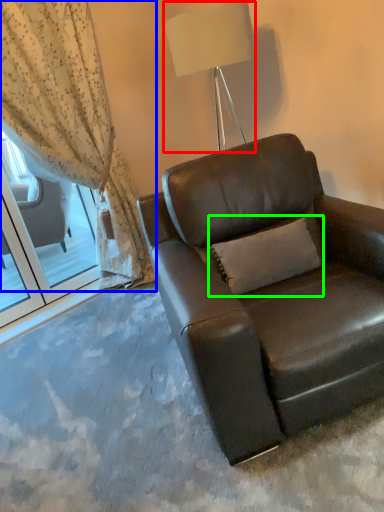
Question: Considering the real-world distances, which object is farthest from lamp (highlighted by a red box)? curtain (highlighted by a blue box) or pillow (highlighted by a green box)?

Choices:
 (A) curtain
 (B) pillow

Answer: (B)